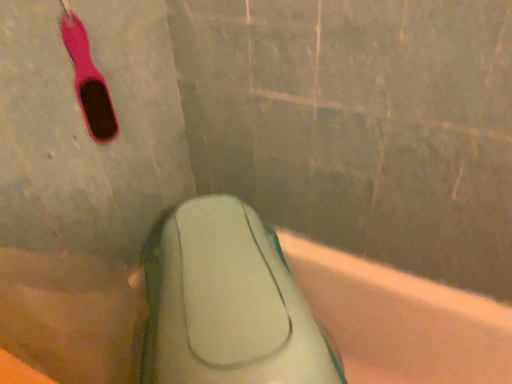
Describe the element at coordinates (88, 80) in the screenshot. This screenshot has width=512, height=384. I see `pink rubber toothbrush at upper left` at that location.

In order to face pink rubber toothbrush at upper left, should I rotate leftwards or rightwards?

Rotate left and turn 21.773 degrees.

You are a GUI agent. You are given a task and a screenshot of the screen. Output one action in this format:
    pyautogui.click(x=<x>, y=<y>)
    Task: Click on the pink rubber toothbrush at upper left
    
    Given the screenshot: What is the action you would take?
    pyautogui.click(x=88, y=80)

The width and height of the screenshot is (512, 384). What do you see at coordinates (401, 320) in the screenshot? I see `green rubber sponge at lower center` at bounding box center [401, 320].

The image size is (512, 384). I want to click on green rubber sponge at lower center, so click(401, 320).

Where is `pink rubber toothbrush at upper left`? Image resolution: width=512 pixels, height=384 pixels. pink rubber toothbrush at upper left is located at coordinates coord(88,80).

Is green rubber sponge at lower center to the left of pink rubber toothbrush at upper left from the viewer's perspective?

In fact, green rubber sponge at lower center is to the right of pink rubber toothbrush at upper left.

In the scene shown: Relative to pink rubber toothbrush at upper left, is green rubber sponge at lower center in front or behind?

In the image, green rubber sponge at lower center appears in front of pink rubber toothbrush at upper left.

Is point (494, 348) closer to viewer compared to point (90, 65)?

That is False.

From the image's perspective, is green rubber sponge at lower center on top of pink rubber toothbrush at upper left?

No.

From a real-world perspective, is green rubber sponge at lower center physically located above or below pink rubber toothbrush at upper left?

green rubber sponge at lower center is situated lower than pink rubber toothbrush at upper left in the real world.

Is green rubber sponge at lower center wider than pink rubber toothbrush at upper left?

Yes, green rubber sponge at lower center is wider than pink rubber toothbrush at upper left.

From their relative heights in the image, would you say green rubber sponge at lower center is taller or shorter than pink rubber toothbrush at upper left?

green rubber sponge at lower center is taller than pink rubber toothbrush at upper left.

Can you confirm if green rubber sponge at lower center is smaller than pink rubber toothbrush at upper left?

Actually, green rubber sponge at lower center might be larger than pink rubber toothbrush at upper left.

Do you think green rubber sponge at lower center is within pink rubber toothbrush at upper left, or outside of it?

green rubber sponge at lower center is not enclosed by pink rubber toothbrush at upper left.

Is green rubber sponge at lower center next to pink rubber toothbrush at upper left?

green rubber sponge at lower center and pink rubber toothbrush at upper left are clearly separated.

Is green rubber sponge at lower center oriented away from pink rubber toothbrush at upper left?

No, green rubber sponge at lower center's orientation is not away from pink rubber toothbrush at upper left.

Looking at this image, can you tell me how much green rubber sponge at lower center and pink rubber toothbrush at upper left differ in facing direction?

green rubber sponge at lower center and pink rubber toothbrush at upper left are facing 61.1 degrees away from each other.

How far apart are green rubber sponge at lower center and pink rubber toothbrush at upper left?

A distance of 29.48 inches exists between green rubber sponge at lower center and pink rubber toothbrush at upper left.

Locate an element on the screen. Image resolution: width=512 pixels, height=384 pixels. bath located below the pink rubber toothbrush at upper left (from the image's perspective) is located at coordinates (401, 320).

Between pink rubber toothbrush at upper left and green rubber sponge at lower center, which one appears on the left side from the viewer's perspective?

Positioned to the left is pink rubber toothbrush at upper left.

Which is behind, pink rubber toothbrush at upper left or green rubber sponge at lower center?

Positioned behind is pink rubber toothbrush at upper left.

Is point (70, 44) more distant than point (4, 304)?

Yes, it is behind point (4, 304).

From the image's perspective, between pink rubber toothbrush at upper left and green rubber sponge at lower center, which one is located above?

pink rubber toothbrush at upper left, from the image's perspective.

From a real-world perspective, is pink rubber toothbrush at upper left physically below green rubber sponge at lower center?

Actually, pink rubber toothbrush at upper left is physically above green rubber sponge at lower center in the real world.

In terms of width, does pink rubber toothbrush at upper left look wider or thinner when compared to green rubber sponge at lower center?

pink rubber toothbrush at upper left is thinner than green rubber sponge at lower center.

From the picture: Is pink rubber toothbrush at upper left shorter than green rubber sponge at lower center?

Yes.

Is pink rubber toothbrush at upper left smaller than green rubber sponge at lower center?

Correct, pink rubber toothbrush at upper left occupies less space than green rubber sponge at lower center.

Is pink rubber toothbrush at upper left situated inside green rubber sponge at lower center or outside?

pink rubber toothbrush at upper left exists outside the volume of green rubber sponge at lower center.

In the scene shown: Is the surface of pink rubber toothbrush at upper left in direct contact with green rubber sponge at lower center?

There is a gap between pink rubber toothbrush at upper left and green rubber sponge at lower center.

Is green rubber sponge at lower center at the back of pink rubber toothbrush at upper left?

That's not correct — pink rubber toothbrush at upper left is not looking away from green rubber sponge at lower center.

How different are the orientations of pink rubber toothbrush at upper left and green rubber sponge at lower center in degrees?

61.1 degrees separate the facing orientations of pink rubber toothbrush at upper left and green rubber sponge at lower center.

How much distance is there between pink rubber toothbrush at upper left and green rubber sponge at lower center?

pink rubber toothbrush at upper left is 29.48 inches from green rubber sponge at lower center.

Find the location of a particular element. bath on the right side of pink rubber toothbrush at upper left is located at coordinates (401, 320).

The image size is (512, 384). I want to click on bath on the right side of pink rubber toothbrush at upper left, so click(x=401, y=320).

I want to click on bath in front of the pink rubber toothbrush at upper left, so click(x=401, y=320).